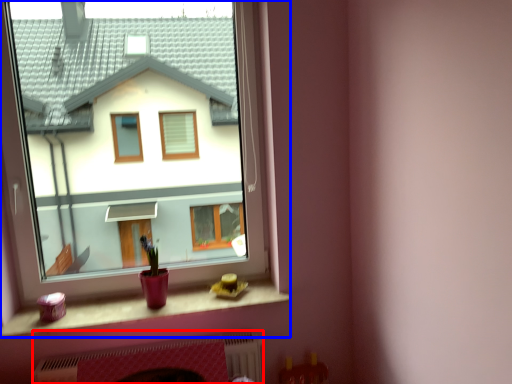
Question: Which object is closer to the camera taking this photo, fireplace (highlighted by a red box) or window (highlighted by a blue box)?

Choices:
 (A) fireplace
 (B) window

Answer: (B)